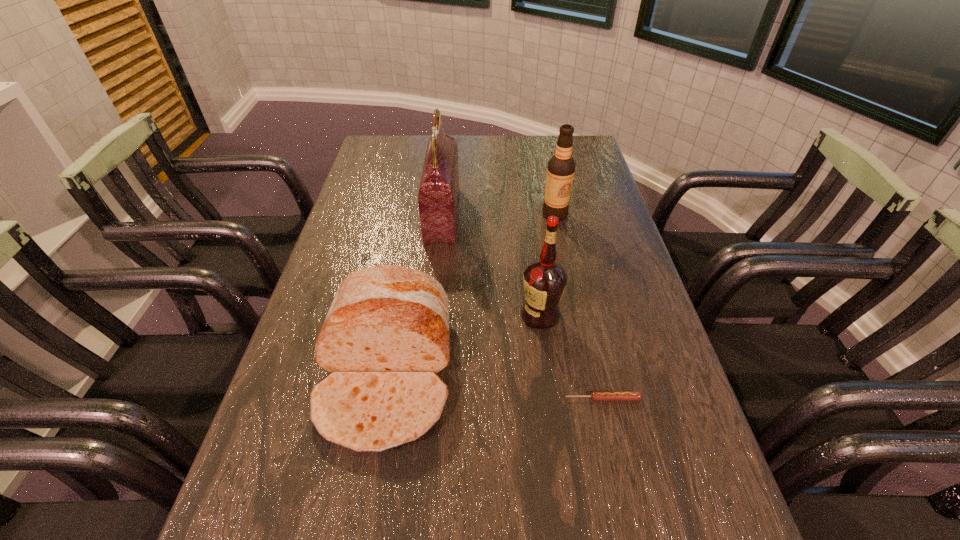
Locate an element on the screen. This screenshot has width=960, height=540. free space located 0.090m at the sliced end of the bread is located at coordinates (362, 511).

Where is `vacant region located on the back of the sausage`? vacant region located on the back of the sausage is located at coordinates (594, 358).

Locate an element on the screen. object at the left edge is located at coordinates (386, 336).

Image resolution: width=960 pixels, height=540 pixels. What are the coordinates of `alcohol located in the right edge section of the desktop` in the screenshot? It's located at (561, 167).

At what (x,y) coordinates should I click in order to perform the action: click on sausage that is at the right edge. Please return your answer as a coordinate pair (x, y). The height and width of the screenshot is (540, 960). Looking at the image, I should click on (596, 395).

I want to click on vacant area at the far edge of the desktop, so click(479, 165).

Locate an element on the screen. blank area at the left edge is located at coordinates (362, 177).

You are a GUI agent. You are given a task and a screenshot of the screen. Output one action in this format:
    pyautogui.click(x=<x>, y=<y>)
    Task: Click on the vacant region at the right edge of the desktop
    This screenshot has height=540, width=960.
    Given the screenshot: What is the action you would take?
    pyautogui.click(x=660, y=353)

Locate an element on the screen. The image size is (960, 540). vacant point located between the farther alcohol and the bread is located at coordinates coord(470,293).

Find the location of a particular element. The image size is (960, 540). free space between the nearer alcohol and the bread is located at coordinates [464, 343].